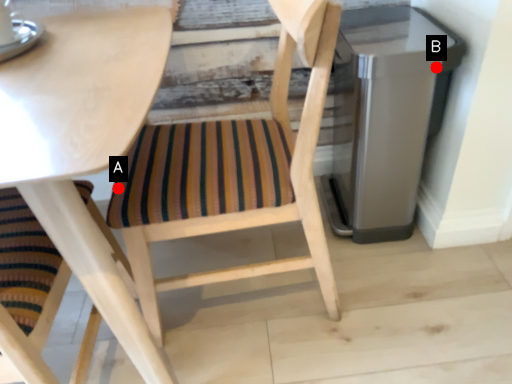
Question: Two points are circled on the image, labeled by A and B beside each circle. Among these points, which one is nearest to the camera?

Choices:
 (A) A is closer
 (B) B is closer

Answer: (A)